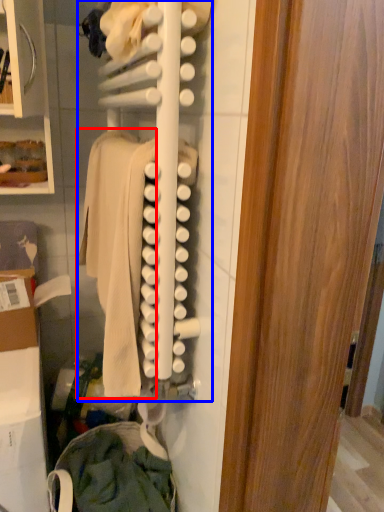
Question: Among these objects, which one is nearest to the camera, clothing (highlighted by a red box) or closet (highlighted by a blue box)?

Choices:
 (A) clothing
 (B) closet

Answer: (B)